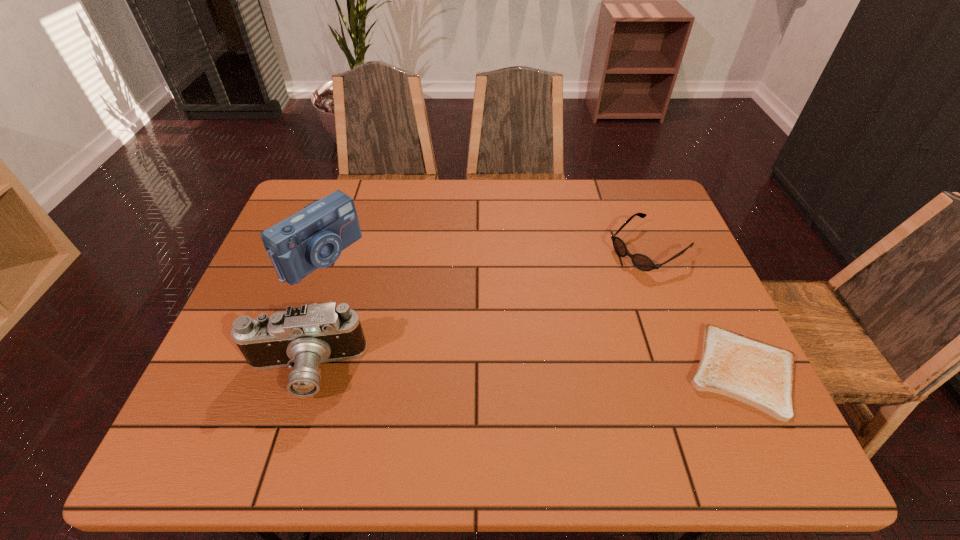
The width and height of the screenshot is (960, 540). Identify the location of the nearer camera. (302, 337).

Identify the location of toast. This screenshot has height=540, width=960. (761, 375).

At what (x,y) coordinates should I click in order to perform the action: click on the farther camera. Please return your answer as a coordinate pair (x, y). This screenshot has height=540, width=960. Looking at the image, I should click on (314, 237).

Where is `the second shortest object`? This screenshot has width=960, height=540. the second shortest object is located at coordinates (642, 262).

Locate an element on the screen. This screenshot has height=540, width=960. vacant space located 0.080m on the left of the shortest object is located at coordinates (649, 371).

At what (x,y) coordinates should I click in order to perform the action: click on vacant space located 0.290m on the lens of the farther camera. Please return your answer as a coordinate pair (x, y). Image resolution: width=960 pixels, height=540 pixels. Looking at the image, I should click on (423, 331).

Identify the location of free space located 0.370m on the lens of the farther camera. (449, 349).

Identify the location of vacant region located on the lens of the farther camera. (460, 356).

The image size is (960, 540). I want to click on free space located 0.400m on the lenses of the sunglasses, so click(510, 341).

Find the location of a particular element. This screenshot has width=960, height=540. free location located on the lenses of the sunglasses is located at coordinates (571, 300).